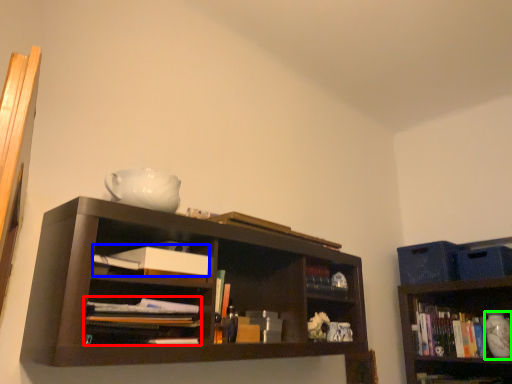
Question: Based on their relative distances, which object is nearer to book (highlighted by a red box)? Choose from paperback book (highlighted by a blue box) and glass vase (highlighted by a green box).

Choices:
 (A) paperback book
 (B) glass vase

Answer: (A)